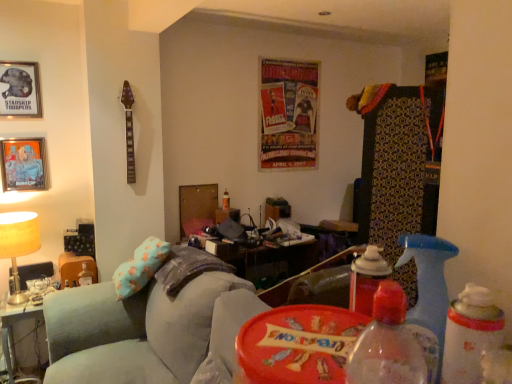
Question: Should I look upward or downward to see matte gold table lamp at left?

Choices:
 (A) up
 (B) down

Answer: (B)

Question: From the image's perspective, is orange matte picture frame at left, acting as the 1th picture frame starting from the bottom, on top of metallic silver picture frame at upper left, which appears as the second picture frame when ordered from the bottom?

Choices:
 (A) no
 (B) yes

Answer: (A)

Question: Are orange matte picture frame at left, acting as the 1th picture frame starting from the bottom, and metallic silver picture frame at upper left, arranged as the 1th picture frame when viewed from the top, far apart?

Choices:
 (A) no
 (B) yes

Answer: (A)

Question: Is the surface of orange matte picture frame at left, arranged as the 2th picture frame when viewed from the top, in direct contact with metallic silver picture frame at upper left, arranged as the 1th picture frame when viewed from the top?

Choices:
 (A) yes
 (B) no

Answer: (B)

Question: Can you confirm if orange matte picture frame at left, arranged as the 2th picture frame when viewed from the top, is positioned to the left of metallic silver picture frame at upper left, which appears as the second picture frame when ordered from the bottom?

Choices:
 (A) no
 (B) yes

Answer: (A)

Question: From the image's perspective, does orange matte picture frame at left, acting as the 1th picture frame starting from the bottom, appear lower than metallic silver picture frame at upper left, which appears as the second picture frame when ordered from the bottom?

Choices:
 (A) yes
 (B) no

Answer: (A)

Question: From a real-world perspective, is orange matte picture frame at left, arranged as the 2th picture frame when viewed from the top, beneath metallic silver picture frame at upper left, which appears as the second picture frame when ordered from the bottom?

Choices:
 (A) yes
 (B) no

Answer: (A)

Question: Does metallic silver picture frame at upper left, which appears as the second picture frame when ordered from the bottom, turn towards light blue fabric pillow at left?

Choices:
 (A) no
 (B) yes

Answer: (A)

Question: Is metallic silver picture frame at upper left, arranged as the 1th picture frame when viewed from the top, positioned beyond the bounds of light blue fabric pillow at left?

Choices:
 (A) yes
 (B) no

Answer: (A)

Question: From a real-world perspective, does metallic silver picture frame at upper left, which appears as the second picture frame when ordered from the bottom, sit lower than light blue fabric pillow at left?

Choices:
 (A) yes
 (B) no

Answer: (B)

Question: From the image's perspective, is metallic silver picture frame at upper left, arranged as the 1th picture frame when viewed from the top, located beneath light blue fabric pillow at left?

Choices:
 (A) yes
 (B) no

Answer: (B)

Question: Would you say light blue fabric pillow at left is part of metallic silver picture frame at upper left, arranged as the 1th picture frame when viewed from the top,'s contents?

Choices:
 (A) no
 (B) yes

Answer: (A)

Question: Does metallic silver picture frame at upper left, which appears as the second picture frame when ordered from the bottom, come behind light blue fabric pillow at left?

Choices:
 (A) yes
 (B) no

Answer: (A)

Question: Is translucent plastic spray bottle at right, which appears as the first bottle when viewed from the right, located outside orange matte picture frame at left, arranged as the 2th picture frame when viewed from the top?

Choices:
 (A) yes
 (B) no

Answer: (A)